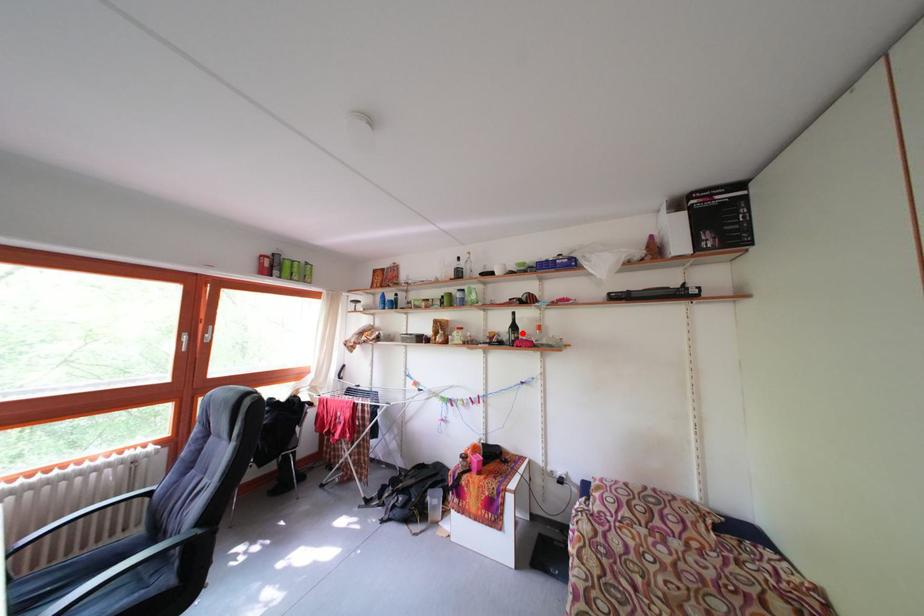
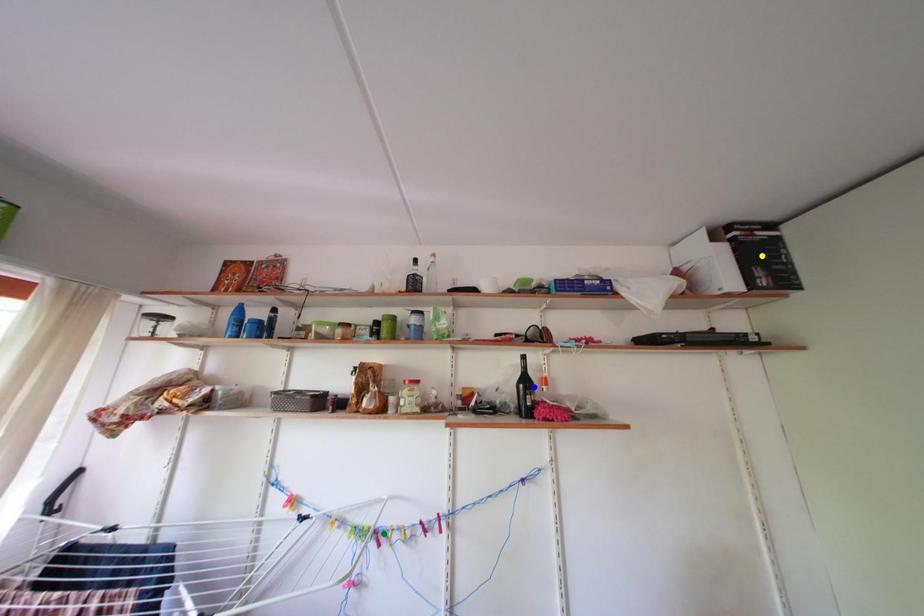
Question: I am providing you with two images of the same scene from different viewpoints. A red point is marked on the first image. You are given multiple points on the second image. Which point in image 2 is actually the same real-world point as the red point in image 1?

Choices:
 (A) yellow point
 (B) green point
 (C) blue point

Answer: (C)